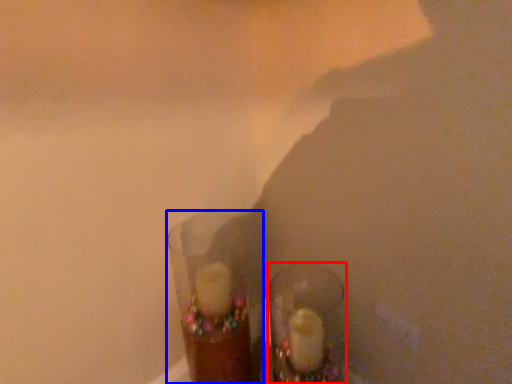
Question: Which object appears farthest to the camera in this image, footwear (highlighted by a red box) or shot glass (highlighted by a blue box)?

Choices:
 (A) footwear
 (B) shot glass

Answer: (A)